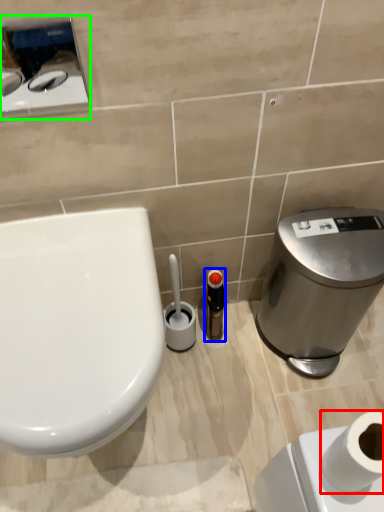
Question: Which object is positioned closest to toilet paper (highlighted by a red box)? Select from toiletry (highlighted by a blue box) and appliance (highlighted by a green box).

Choices:
 (A) toiletry
 (B) appliance

Answer: (A)